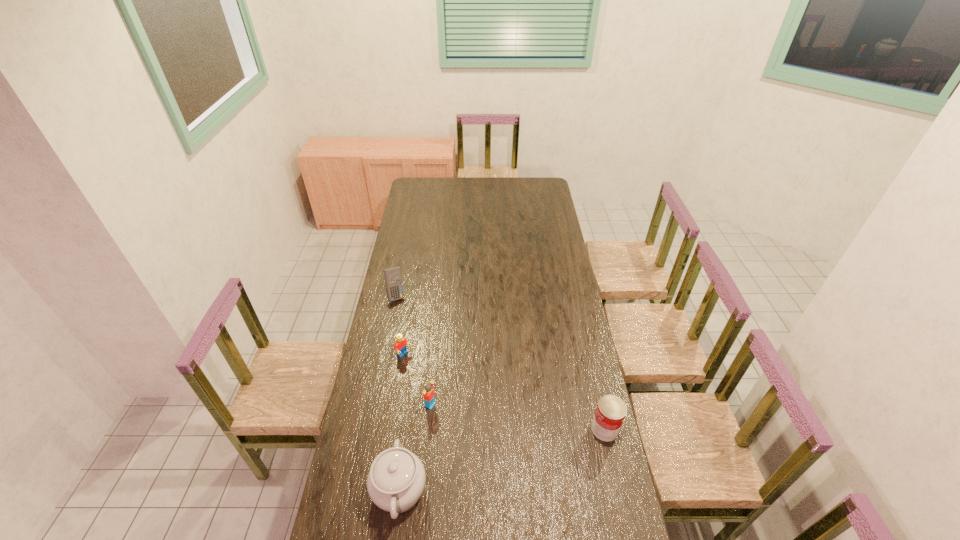
At what (x,y) coordinates should I click in order to perform the action: click on vacant space on the desktop that is between the nearest object and the rightmost object and is positioned on the face of the right Lego. Please return your answer as a coordinate pair (x, y). Looking at the image, I should click on (528, 452).

Where is `free space on the desktop that is between the nearest object and the can and is positioned on the face of the second farthest object`? The image size is (960, 540). free space on the desktop that is between the nearest object and the can and is positioned on the face of the second farthest object is located at coordinates click(533, 450).

Find the location of a particular element. The height and width of the screenshot is (540, 960). vacant spot on the desktop that is between the nearest object and the can and is positioned on the front-facing side of the calculator is located at coordinates (478, 467).